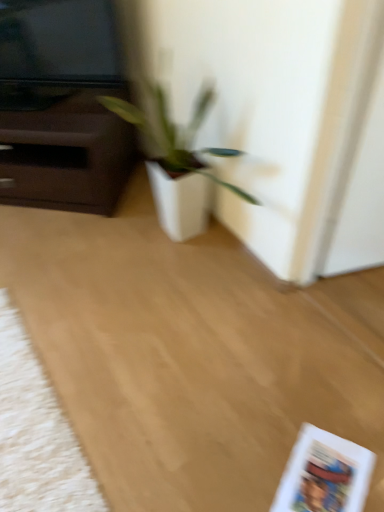
This screenshot has height=512, width=384. Find the location of `free space above white matte paperback book at lower right (from a real-world perspective)`. free space above white matte paperback book at lower right (from a real-world perspective) is located at coordinates (336, 474).